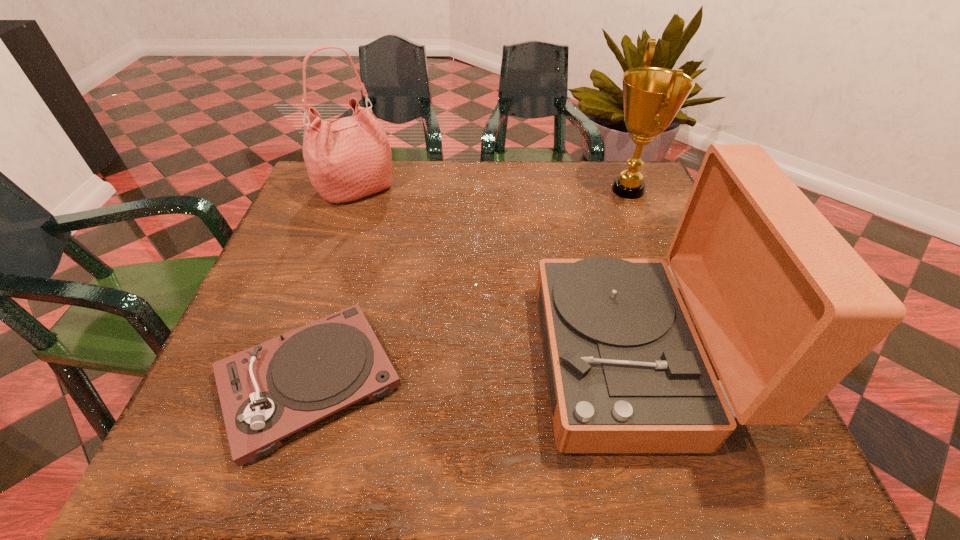
Locate an element on the screen. Image resolution: width=960 pixels, height=540 pixels. vacant point located between the handbag and the award is located at coordinates (492, 190).

Where is `vacant space in between the shorter phonograph_record and the award`? The height and width of the screenshot is (540, 960). vacant space in between the shorter phonograph_record and the award is located at coordinates (468, 286).

I want to click on vacant space that's between the handbag and the award, so (x=492, y=190).

Locate an element on the screen. free spot between the award and the handbag is located at coordinates (492, 190).

Where is `vacant area between the handbag and the award`? The height and width of the screenshot is (540, 960). vacant area between the handbag and the award is located at coordinates (492, 190).

The height and width of the screenshot is (540, 960). I want to click on vacant region between the right phonograph_record and the left phonograph_record, so click(470, 370).

The image size is (960, 540). I want to click on unoccupied position between the shorter phonograph_record and the award, so click(468, 286).

Locate an element on the screen. Image resolution: width=960 pixels, height=540 pixels. vacant point located between the taller phonograph_record and the handbag is located at coordinates (494, 275).

At what (x,y) coordinates should I click in order to perform the action: click on object that is the third closest to the left phonograph_record. Please return your answer as a coordinate pair (x, y). Looking at the image, I should click on (652, 96).

The height and width of the screenshot is (540, 960). Identify the location of object that is the second closest to the handbag. (786, 308).